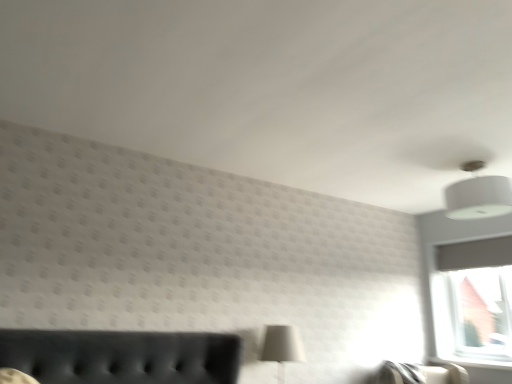
Describe the element at coordinates (282, 347) in the screenshot. I see `white matte table lamp at lower center` at that location.

What do you see at coordinates (478, 198) in the screenshot? I see `white fabric lampshade at upper right` at bounding box center [478, 198].

Image resolution: width=512 pixels, height=384 pixels. I want to click on white matte table lamp at lower center, so click(282, 347).

Is white glossy window sill at lower right far away from white matte table lamp at lower center?

Yes, white glossy window sill at lower right is far from white matte table lamp at lower center.

Is white glossy window sill at lower right thinner than white matte table lamp at lower center?

Yes.

Is white glossy window sill at lower right in front of or behind white matte table lamp at lower center in the image?

white glossy window sill at lower right is behind white matte table lamp at lower center.

Is white fabric lampshade at upper right in front of or behind white glossy window sill at lower right in the image?

Visually, white fabric lampshade at upper right is located in front of white glossy window sill at lower right.

Is white fabric lampshade at upper right at the right side of white glossy window sill at lower right?

No.

From the image's perspective, between white fabric lampshade at upper right and white glossy window sill at lower right, who is located below?

white glossy window sill at lower right, from the image's perspective.

Between white fabric lampshade at upper right and white glossy window sill at lower right, which one has smaller size?

Smaller between the two is white glossy window sill at lower right.

Is white matte table lamp at lower center positioned beyond the bounds of white glossy window sill at lower right?

Yes.

Is white matte table lamp at lower center next to white glossy window sill at lower right?

No, white matte table lamp at lower center is not next to white glossy window sill at lower right.

From the image's perspective, who appears lower, white matte table lamp at lower center or white glossy window sill at lower right?

white glossy window sill at lower right, from the image's perspective.

From the picture: Between white matte table lamp at lower center and white glossy window sill at lower right, which one has less height?

Standing shorter between the two is white glossy window sill at lower right.

From a real-world perspective, is white matte table lamp at lower center positioned over white fabric lampshade at upper right based on gravity?

Actually, white matte table lamp at lower center is physically below white fabric lampshade at upper right in the real world.

Which of these two, white matte table lamp at lower center or white fabric lampshade at upper right, is wider?

white fabric lampshade at upper right.

Considering the sizes of white matte table lamp at lower center and white fabric lampshade at upper right in the image, is white matte table lamp at lower center taller or shorter than white fabric lampshade at upper right?

Considering their sizes, white matte table lamp at lower center has more height than white fabric lampshade at upper right.

Does point (282, 369) lie in front of point (449, 198)?

No, (282, 369) is further to viewer.

At what (x,y) coordinates should I click in order to perform the action: click on window sill that is behind the white fabric lampshade at upper right. Please return your answer as a coordinate pair (x, y). Looking at the image, I should click on (471, 363).

Are white glossy window sill at lower right and white fabric lampshade at upper right far apart?

That's right, there is a large distance between white glossy window sill at lower right and white fabric lampshade at upper right.

Which point is more forward, [510,362] or [484,166]?

The point [484,166] is more forward.

How different are the orientations of white glossy window sill at lower right and white fabric lampshade at upper right in degrees?

The facing directions of white glossy window sill at lower right and white fabric lampshade at upper right are 0.395 degrees apart.

Considering the positions of objects white fabric lampshade at upper right and white matte table lamp at lower center in the image provided, who is more to the left, white fabric lampshade at upper right or white matte table lamp at lower center?

From the viewer's perspective, white matte table lamp at lower center appears more on the left side.

Between white fabric lampshade at upper right and white matte table lamp at lower center, which one has smaller size?

Smaller between the two is white matte table lamp at lower center.

How far apart are white fabric lampshade at upper right and white matte table lamp at lower center?

1.59 meters.

Would you say white matte table lamp at lower center is part of white fabric lampshade at upper right's contents?

No.

Image resolution: width=512 pixels, height=384 pixels. Identify the location of window sill below the white matte table lamp at lower center (from a real-world perspective). (471, 363).

Where is `lamp on the left of white glossy window sill at lower right`? Image resolution: width=512 pixels, height=384 pixels. lamp on the left of white glossy window sill at lower right is located at coordinates (478, 198).

From the image, which object appears to be farther from white glossy window sill at lower right, white matte table lamp at lower center or white fabric lampshade at upper right?

white matte table lamp at lower center is further to white glossy window sill at lower right.

Which object lies nearer to the anchor point white matte table lamp at lower center, white fabric lampshade at upper right or white glossy window sill at lower right?

Among the two, white fabric lampshade at upper right is located nearer to white matte table lamp at lower center.

Which object lies further to the anchor point white fabric lampshade at upper right, white glossy window sill at lower right or white matte table lamp at lower center?

white glossy window sill at lower right.

Looking at the image, which one is located closer to white matte table lamp at lower center, white glossy window sill at lower right or white fabric lampshade at upper right?

The object closer to white matte table lamp at lower center is white fabric lampshade at upper right.

Estimate the real-world distances between objects in this image. Which object is closer to white glossy window sill at lower right, white fabric lampshade at upper right or white matte table lamp at lower center?

white fabric lampshade at upper right lies closer to white glossy window sill at lower right than the other object.

From the image, which object appears to be nearer to white fabric lampshade at upper right, white matte table lamp at lower center or white glossy window sill at lower right?

white matte table lamp at lower center.

Where is `lamp between white matte table lamp at lower center and white glossy window sill at lower right`? The width and height of the screenshot is (512, 384). lamp between white matte table lamp at lower center and white glossy window sill at lower right is located at coordinates (478, 198).